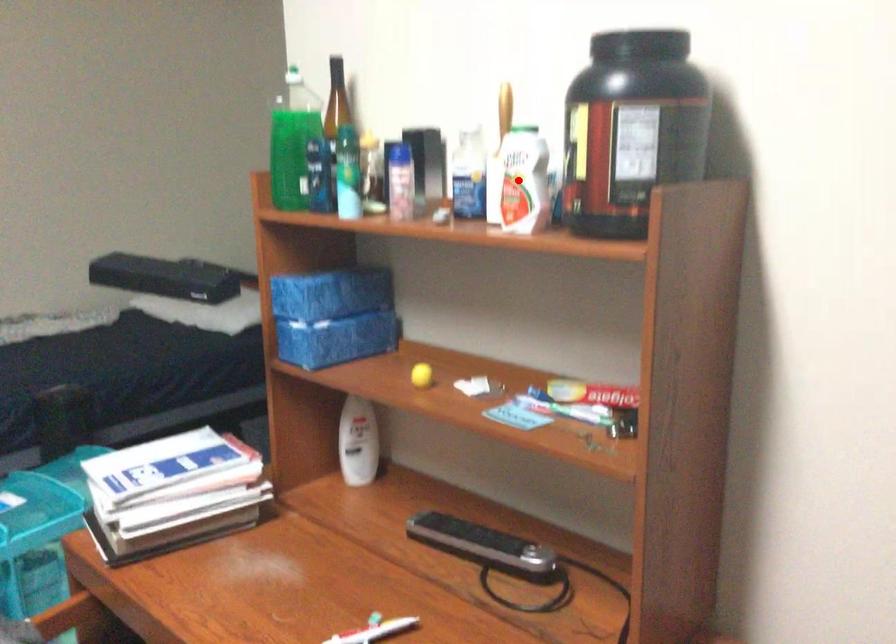
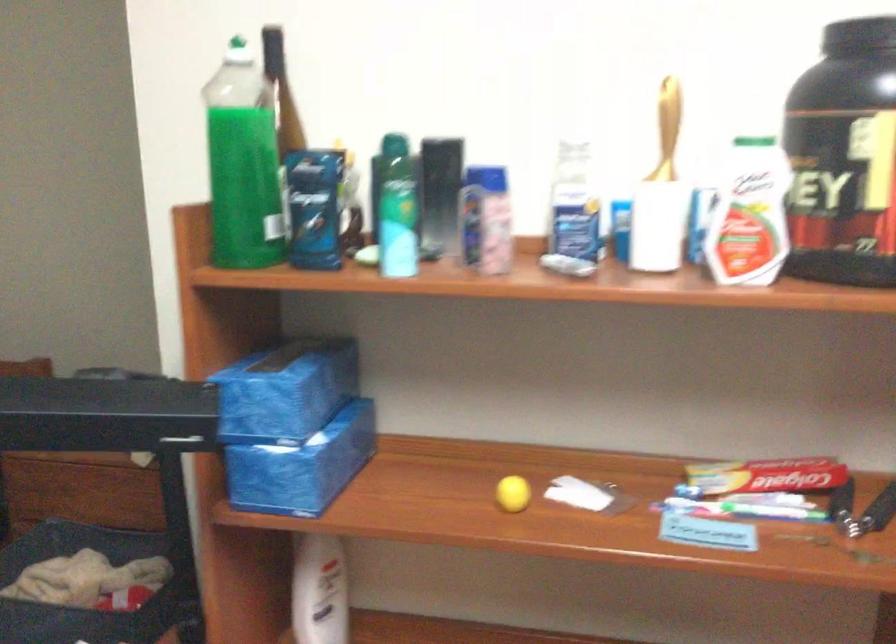
Find the pixel in the second image that matches the highlighted location in the first image.

(748, 214)